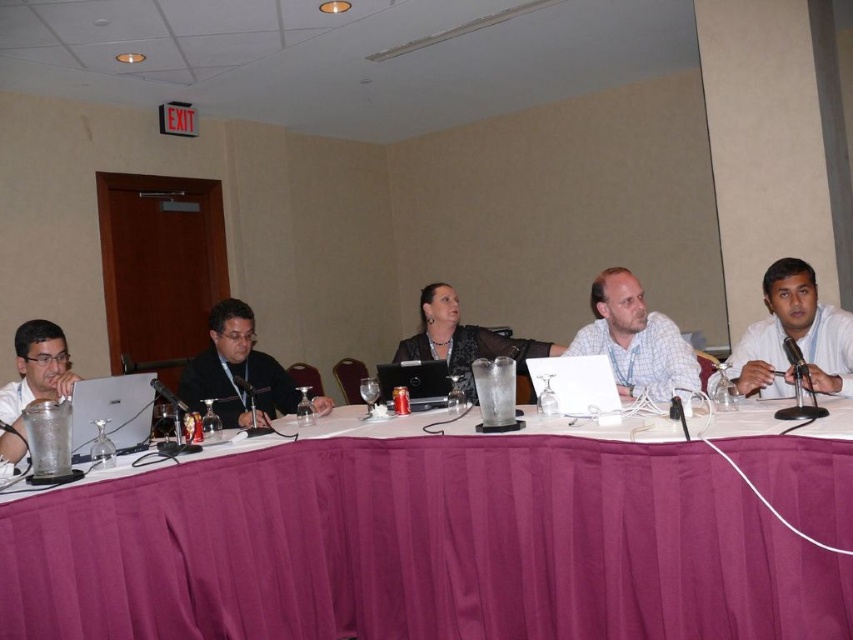
Question: From the image, what is the correct spatial relationship of purple fabric table at center in relation to white plastic laptop at center?

Choices:
 (A) left
 (B) right

Answer: (A)

Question: Among these objects, which one is nearest to the camera?

Choices:
 (A) black plastic laptop at center
 (B) matte black suit at center
 (C) white checkered shirt at center

Answer: (C)

Question: Based on their relative distances, which object is nearer to the silver metallic laptop at left?

Choices:
 (A) white shirt at right
 (B) matte black jacket at center
 (C) black plastic laptop at center
 (D) clear plastic cup at left

Answer: (D)

Question: Is purple fabric table at center below matte black suit at center?

Choices:
 (A) no
 (B) yes

Answer: (B)

Question: Which object is farther from the camera taking this photo?

Choices:
 (A) matte black suit at center
 (B) white shirt at right
 (C) clear plastic cup at left

Answer: (A)

Question: Can you confirm if white checkered shirt at center is positioned to the left of clear plastic cup at left?

Choices:
 (A) yes
 (B) no

Answer: (B)